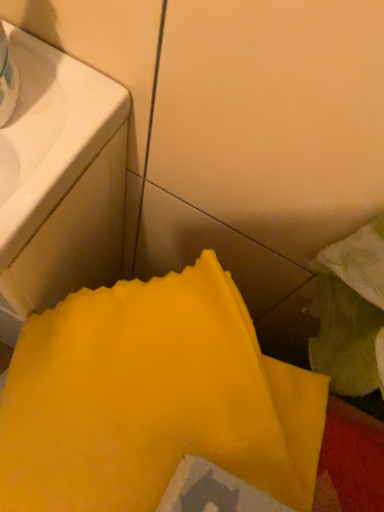
What do you see at coordinates (152, 399) in the screenshot? The height and width of the screenshot is (512, 384). I see `yellow fabric at lower left` at bounding box center [152, 399].

In order to face yellow fabric at lower left, should I rotate leftwards or rightwards?

A 8.525 degree turn to the left will do.

Identify the location of yellow fabric at lower left. (152, 399).

Where is `yellow fabric at lower left`? yellow fabric at lower left is located at coordinates (152, 399).